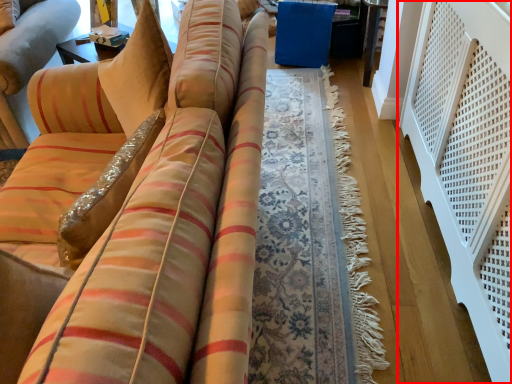
Question: From the image, what is the correct spatial relationship of balustrade (annotated by the red box) in relation to table?

Choices:
 (A) left
 (B) right

Answer: (B)